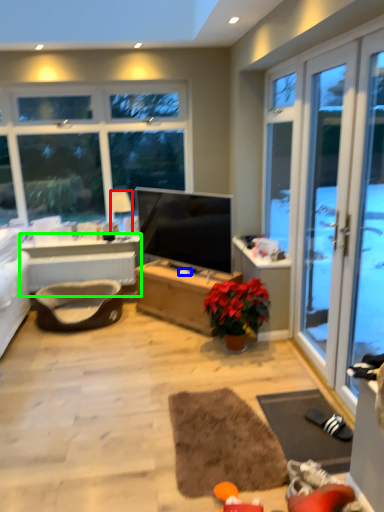
Question: Based on their relative distances, which object is farther from lamp (highlighted by a red box)? Choose from loudspeaker (highlighted by a blue box) and table (highlighted by a green box).

Choices:
 (A) loudspeaker
 (B) table

Answer: (A)